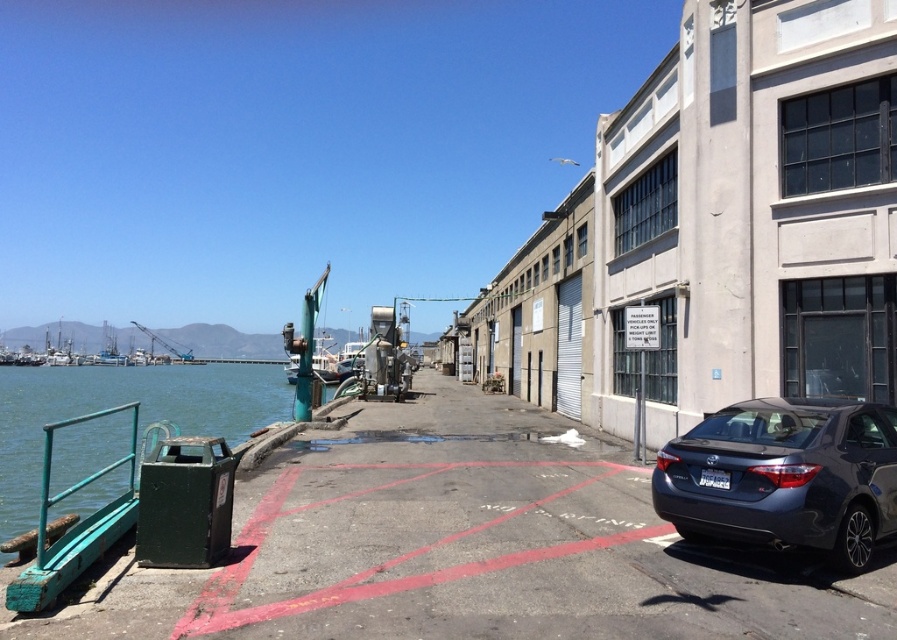
Question: Which object appears closest to the camera in this image?

Choices:
 (A) green metallic water at left
 (B) green matte metal rail at lower left

Answer: (B)

Question: Which object is farther from the camera taking this photo?

Choices:
 (A) green metallic water at left
 (B) green matte metal rail at lower left
 (C) satin dark gray sedan at lower right

Answer: (A)

Question: Is green metallic water at left to the right of green matte metal rail at lower left from the viewer's perspective?

Choices:
 (A) no
 (B) yes

Answer: (A)

Question: Does satin dark gray sedan at lower right come behind green matte metal rail at lower left?

Choices:
 (A) yes
 (B) no

Answer: (A)

Question: Among these points, which one is nearest to the camera?

Choices:
 (A) (817, 470)
 (B) (42, 448)
 (C) (86, 492)

Answer: (A)

Question: Is satin dark gray sedan at lower right further to the viewer compared to green metallic water at left?

Choices:
 (A) yes
 (B) no

Answer: (B)